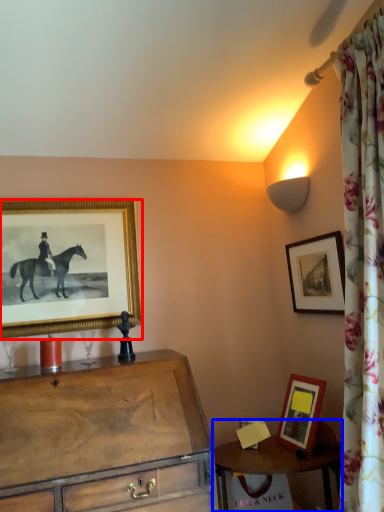
Question: Which object appears farthest to the camera in this image, picture frame (highlighted by a red box) or table (highlighted by a blue box)?

Choices:
 (A) picture frame
 (B) table

Answer: (A)